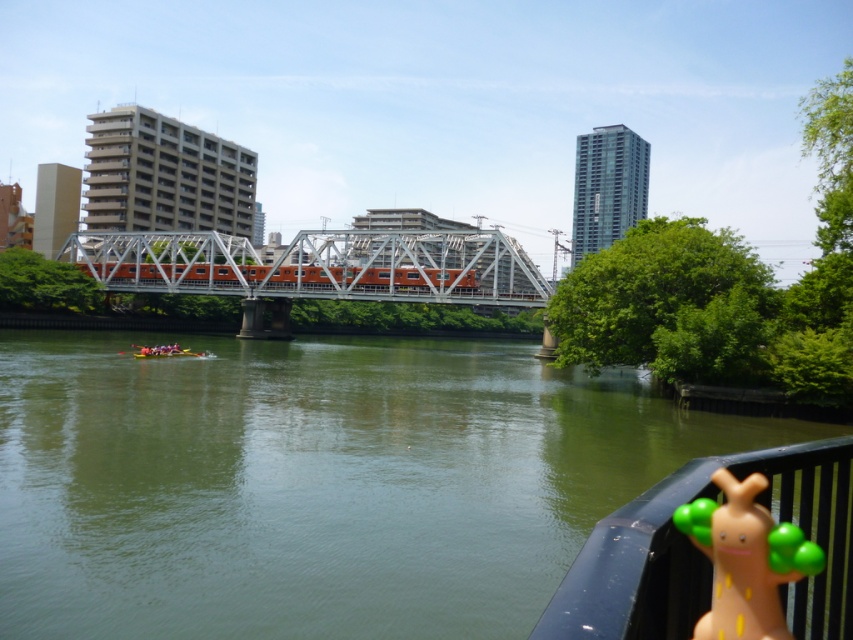
Between point (720, 547) and point (149, 355), which one is positioned in front?

Point (720, 547) is more forward.

Can you confirm if green rubber toy at lower right is positioned above yellow-green plastic boat at lower left?

Yes, green rubber toy at lower right is above yellow-green plastic boat at lower left.

Is point (730, 500) less distant than point (180, 355)?

Yes, it is in front of point (180, 355).

I want to click on green rubber toy at lower right, so click(746, 560).

Between green smooth water at center and yellow-green plastic boat at lower left, which one appears on the left side from the viewer's perspective?

yellow-green plastic boat at lower left

I want to click on green smooth water at center, so point(316,483).

Does orange metallic bridge at center appear on the right side of yellow-green plastic boat at lower left?

Correct, you'll find orange metallic bridge at center to the right of yellow-green plastic boat at lower left.

Who is more distant from viewer, (x=277, y=292) or (x=184, y=353)?

Point (x=277, y=292)

Find the location of a particular element. orange metallic bridge at center is located at coordinates (317, 268).